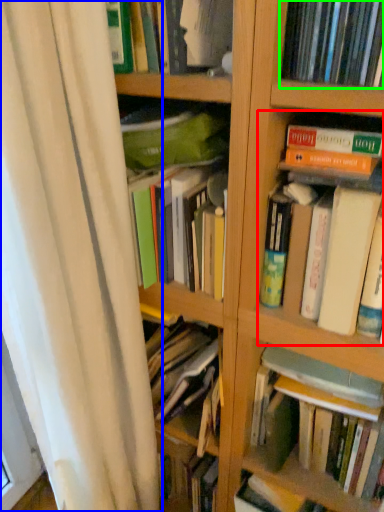
Question: Based on their relative distances, which object is farther from book (highlighted by a red box)? Choose from shower curtain (highlighted by a blue box) and book (highlighted by a green box).

Choices:
 (A) shower curtain
 (B) book

Answer: (A)